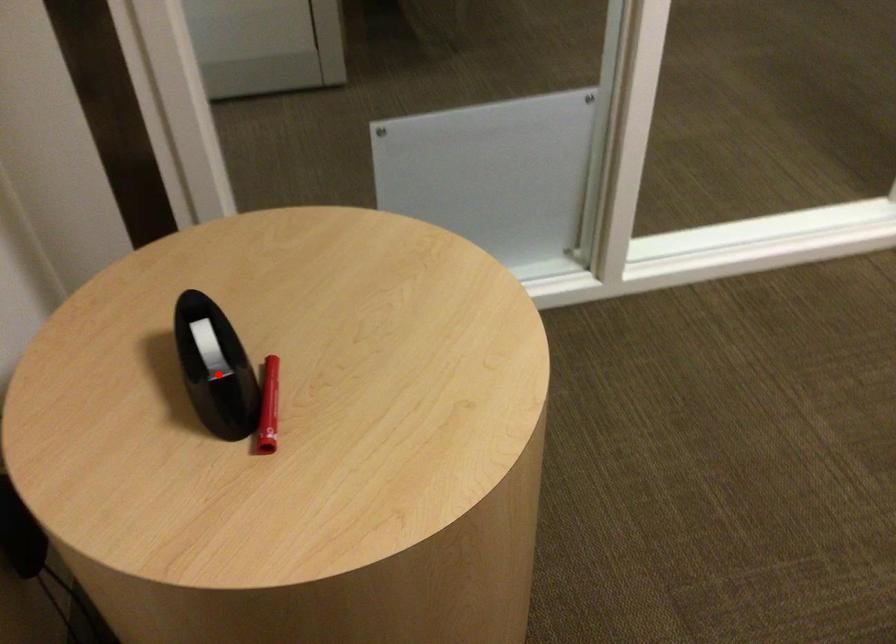
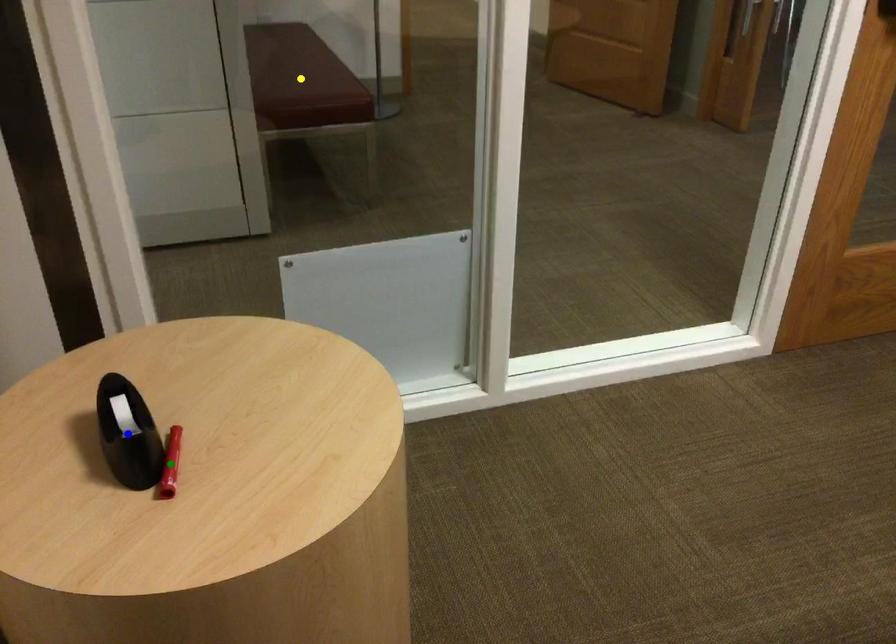
Question: I am providing you with two images of the same scene from different viewpoints. A red point is marked on the first image. You are given multiple points on the second image. Which point in image 2 is actually the same real-world point as the red point in image 1?

Choices:
 (A) yellow point
 (B) blue point
 (C) green point

Answer: (B)